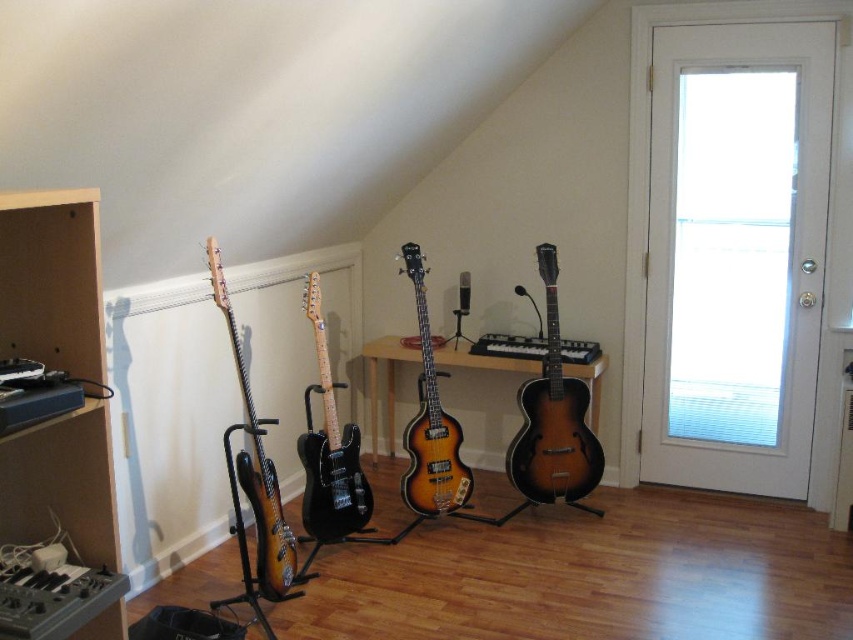
The height and width of the screenshot is (640, 853). What do you see at coordinates (553, 419) in the screenshot?
I see `sunburst wood acoustic guitar at center` at bounding box center [553, 419].

From the picture: Who is positioned more to the right, sunburst wood acoustic guitar at center or black matte electric guitar at center?

sunburst wood acoustic guitar at center

Is point (550, 500) less distant than point (337, 435)?

No, (550, 500) is behind (337, 435).

Where is `sunburst wood acoustic guitar at center`? Image resolution: width=853 pixels, height=640 pixels. sunburst wood acoustic guitar at center is located at coordinates (553, 419).

Can you confirm if sunburst wood acoustic guitar at center is thinner than sunburst wood bass guitar at center?

In fact, sunburst wood acoustic guitar at center might be wider than sunburst wood bass guitar at center.

Based on the photo, between sunburst wood acoustic guitar at center and sunburst wood bass guitar at center, which one has less height?

sunburst wood bass guitar at center

Image resolution: width=853 pixels, height=640 pixels. I want to click on sunburst wood acoustic guitar at center, so click(553, 419).

Is sunburst wood bass guitar at center to the left of sunburst wood electric guitar at left from the viewer's perspective?

No, sunburst wood bass guitar at center is not to the left of sunburst wood electric guitar at left.

Measure the distance between sunburst wood bass guitar at center and camera.

sunburst wood bass guitar at center is 10.49 feet from camera.

Locate an element on the screen. Image resolution: width=853 pixels, height=640 pixels. sunburst wood bass guitar at center is located at coordinates (430, 422).